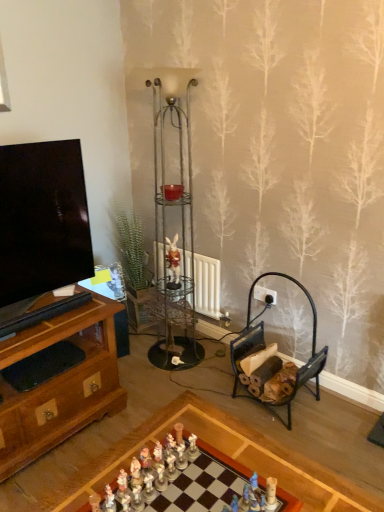
What are the coordinates of `vacant space to the left of shiny silver chess piece at center, positioned as the 2th toy in front-to-back order` in the screenshot? It's located at pos(98,482).